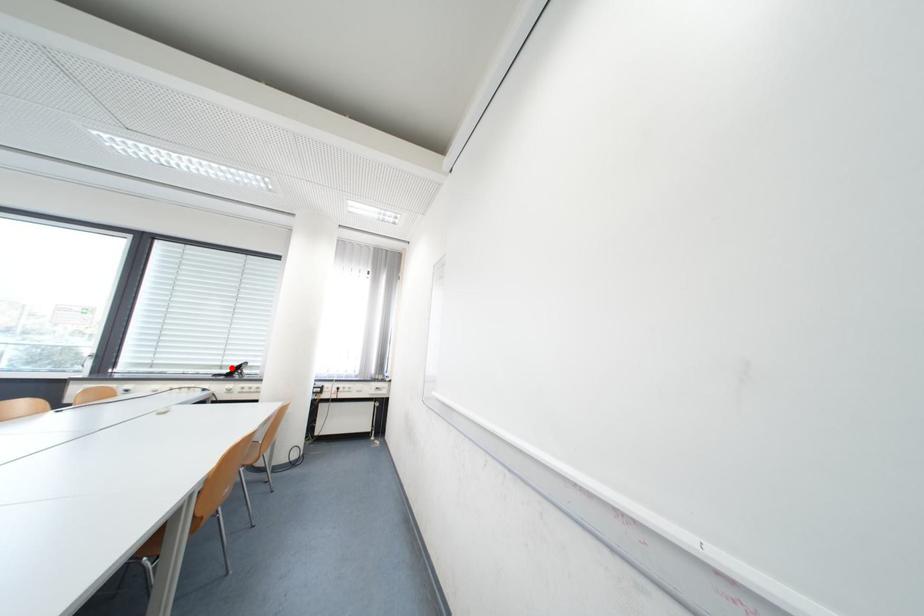
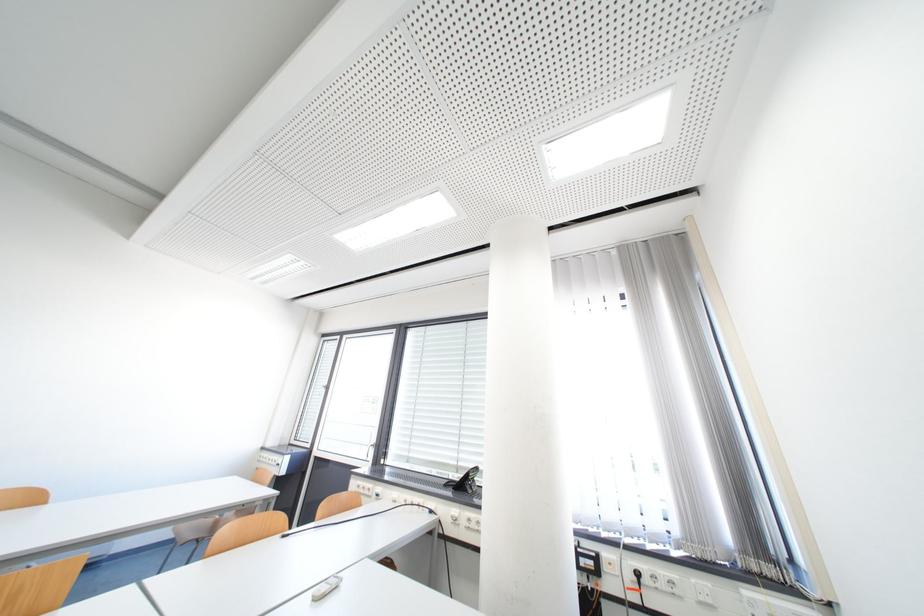
Question: I am providing you with two images of the same scene from different viewpoints. A red point is shown in image1. For the corresponding object point in image2, is it positioned nearer or farther from the camera?

Choices:
 (A) Nearer
 (B) Farther

Answer: (B)